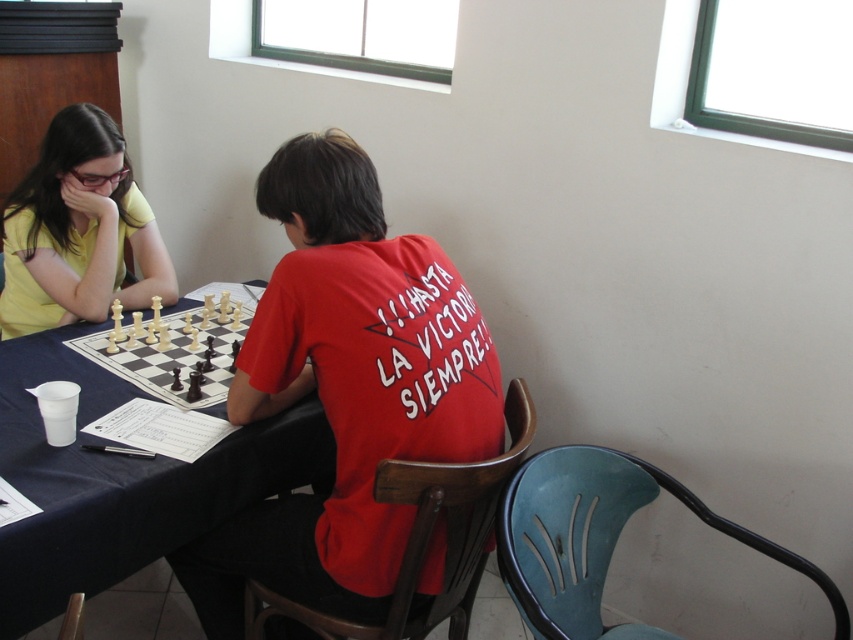
You are standing at the end of the table and see the red matte shirt at center and the blue fabric table at lower left. Which object is closer to your right side?

The red matte shirt at center is to the right of the blue fabric table at lower left, so when standing at the end of the table, the red matte shirt at center would be closer to your right side.

Consider the image. What are the coordinates of the blue fabric table at lower left?

The coordinates of the blue fabric table at lower left are at point [122,483].

You are a delivery robot that needs to place a small package on the blue fabric table at lower left. The package is 15 centimeters wide. Can you slide the white plastic chess set at center to the right to make space?

The distance between the blue fabric table at lower left and white plastic chess set at center is 16.52 centimeters. Since the package is 15 centimeters wide, moving the chess set 1.52 centimeters to the right would create enough space for the package.